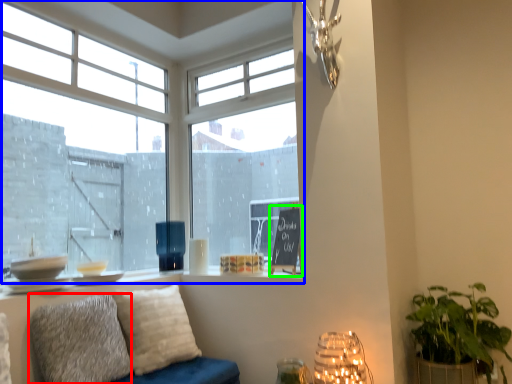
Question: Which object is positioned closest to pillow (highlighted by a red box)? Select from window (highlighted by a blue box) and bulletin board (highlighted by a green box).

Choices:
 (A) window
 (B) bulletin board

Answer: (B)